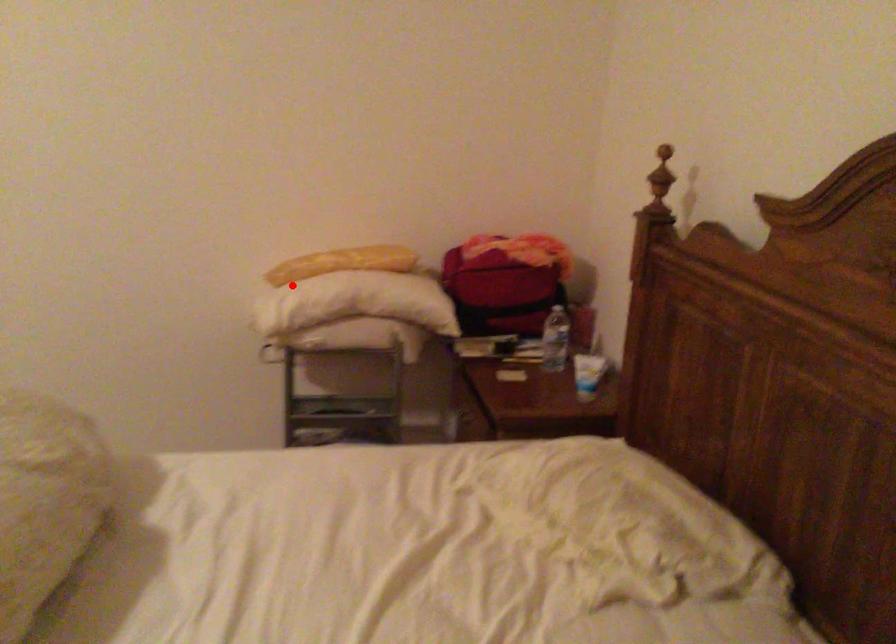
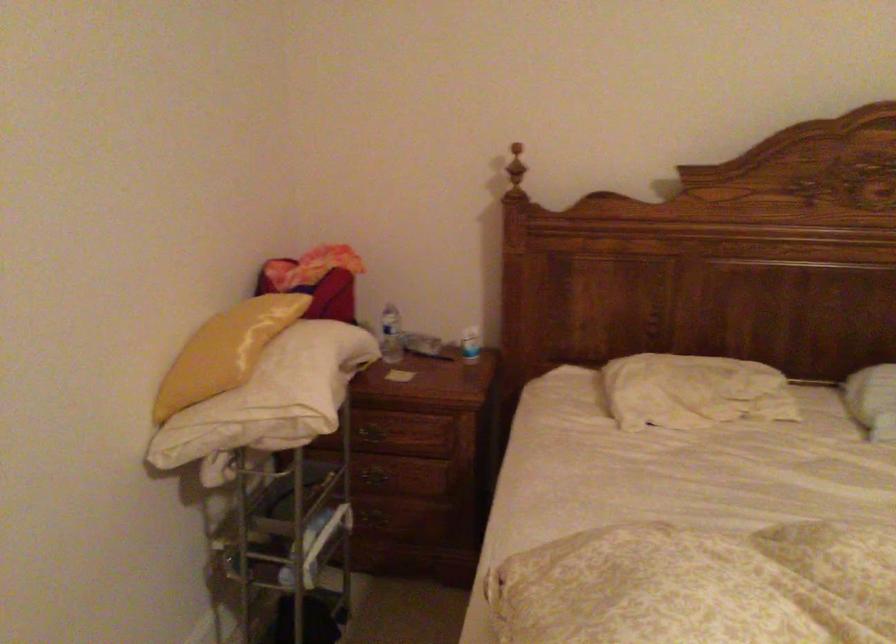
Locate, in the second image, the point that corresponds to the highlighted location in the first image.

(287, 375)